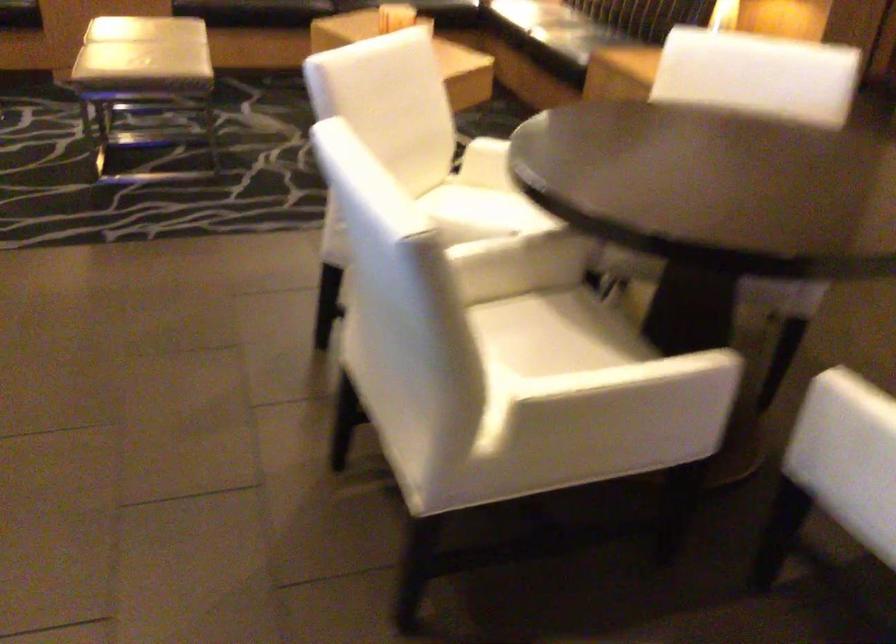
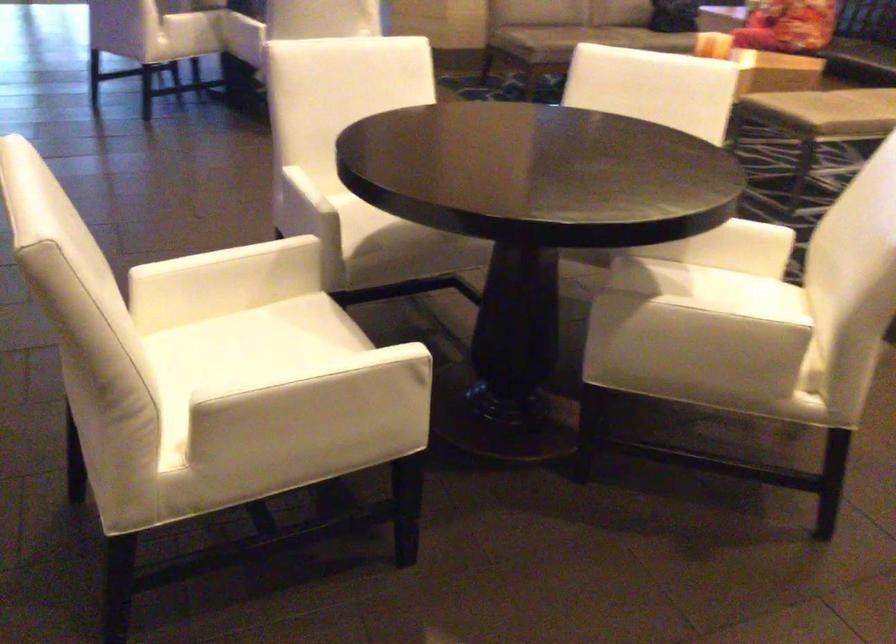
Where in the second image is the point corresponding to (596,366) from the first image?

(372, 223)